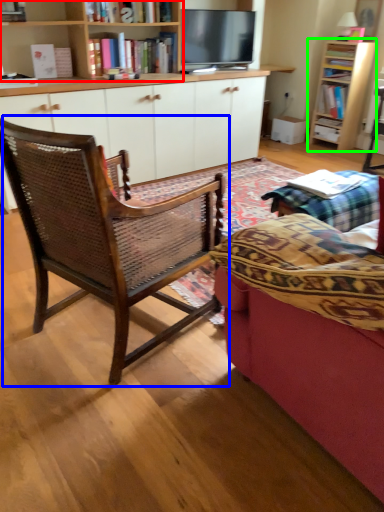
Question: Which object is positioned farthest from bookcase (highlighted by a red box)? Select from chair (highlighted by a blue box) and bookcase (highlighted by a green box).

Choices:
 (A) chair
 (B) bookcase

Answer: (B)